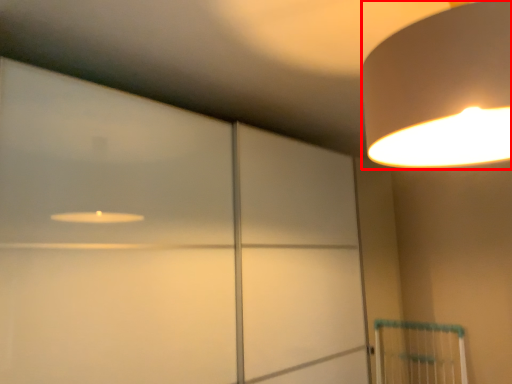
Question: From the image, what is the correct spatial relationship of lamp (annotated by the red box) in relation to glass door?

Choices:
 (A) left
 (B) right

Answer: (B)